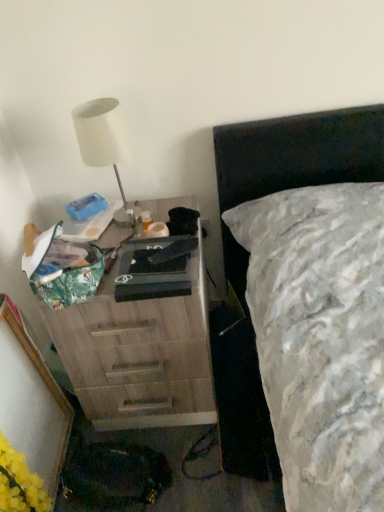
Question: Does white matte lamp at upper left lie in front of wooden chest of drawers at left?

Choices:
 (A) yes
 (B) no

Answer: (B)

Question: Would you say white matte lamp at upper left is a long distance from wooden chest of drawers at left?

Choices:
 (A) no
 (B) yes

Answer: (A)

Question: Considering the relative sizes of white matte lamp at upper left and wooden chest of drawers at left in the image provided, is white matte lamp at upper left thinner than wooden chest of drawers at left?

Choices:
 (A) yes
 (B) no

Answer: (A)

Question: Considering the relative sizes of white matte lamp at upper left and wooden chest of drawers at left in the image provided, is white matte lamp at upper left shorter than wooden chest of drawers at left?

Choices:
 (A) yes
 (B) no

Answer: (A)

Question: Is white matte lamp at upper left behind wooden chest of drawers at left?

Choices:
 (A) yes
 (B) no

Answer: (A)

Question: Is white matte lamp at upper left located outside wooden chest of drawers at left?

Choices:
 (A) no
 (B) yes

Answer: (B)

Question: Considering the relative sizes of wooden chest of drawers at left and white matte lamp at upper left in the image provided, is wooden chest of drawers at left wider than white matte lamp at upper left?

Choices:
 (A) yes
 (B) no

Answer: (A)

Question: Can you confirm if wooden chest of drawers at left is positioned to the right of white matte lamp at upper left?

Choices:
 (A) no
 (B) yes

Answer: (B)

Question: From the image's perspective, does wooden chest of drawers at left appear lower than white matte lamp at upper left?

Choices:
 (A) yes
 (B) no

Answer: (A)

Question: Would you say wooden chest of drawers at left contains white matte lamp at upper left?

Choices:
 (A) yes
 (B) no

Answer: (B)

Question: Is wooden chest of drawers at left looking in the opposite direction of white matte lamp at upper left?

Choices:
 (A) yes
 (B) no

Answer: (B)

Question: Is wooden chest of drawers at left shorter than white matte lamp at upper left?

Choices:
 (A) no
 (B) yes

Answer: (A)

Question: From a real-world perspective, is wooden chest of drawers at left under yellow matte flower at lower left?

Choices:
 (A) no
 (B) yes

Answer: (A)